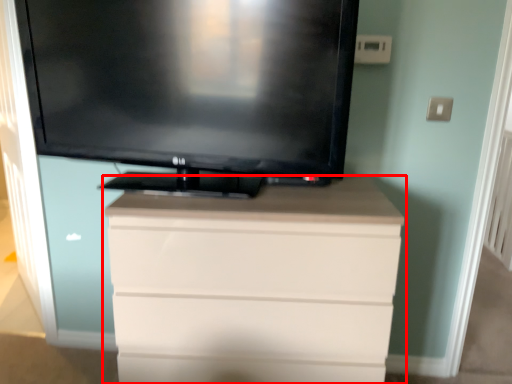
Question: In this image, where is chest of drawers (annotated by the red box) located relative to television?

Choices:
 (A) right
 (B) left

Answer: (A)